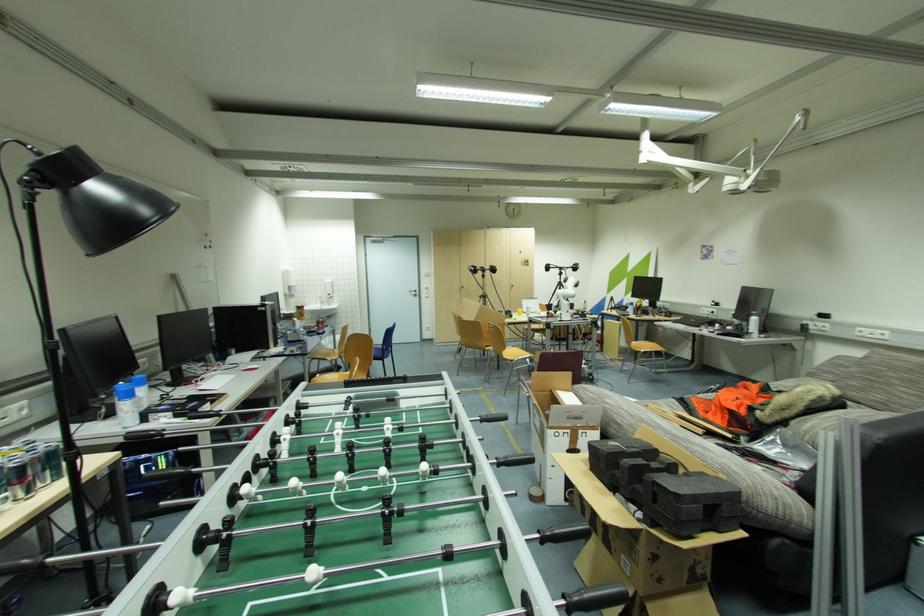
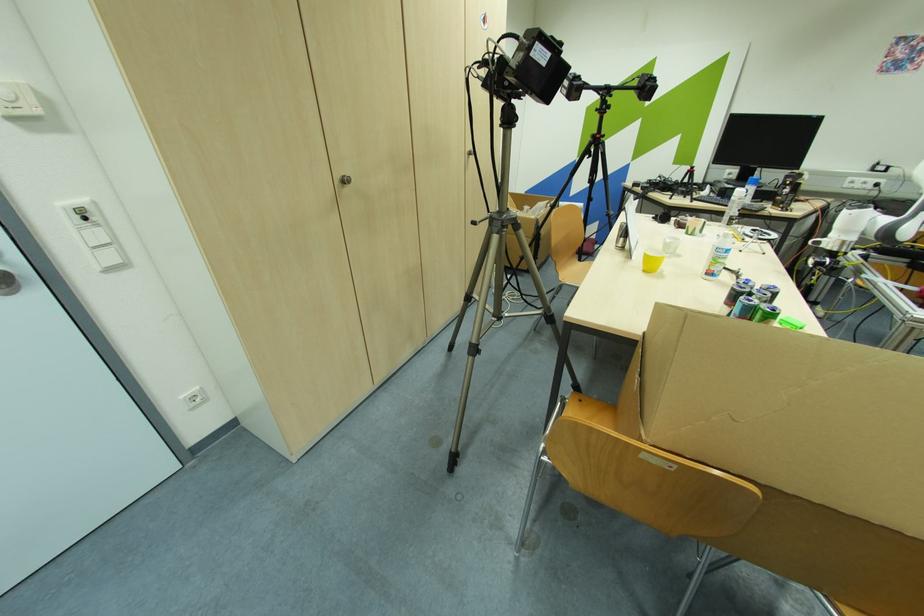
The point at (431, 329) is marked in the first image. Where is the corresponding point in the second image?

(198, 399)